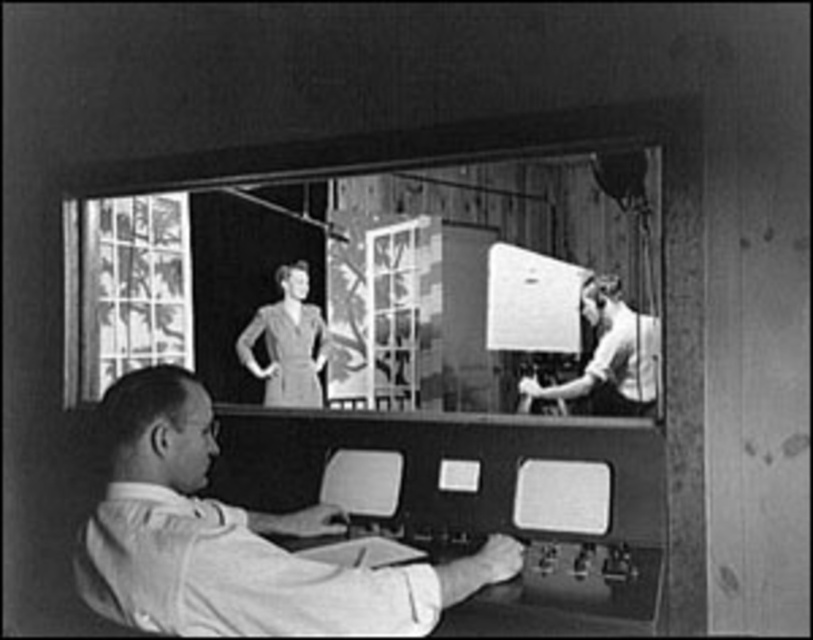
Based on the scene described, where is the smooth white shirt at center located in terms of coordinates?

The smooth white shirt at center is located at coordinates point [235,540].

You are a technician observing the live broadcast on the screen. You notice two points marked on the screen at coordinates point (644, 324) and point (270, 358). Which point is nearer to your viewpoint as you look at the screen?

Point (644, 324) is closer to the camera than point (270, 358), so the point nearer to your viewpoint as you look at the screen is point (644, 324).

You are a technician in the control room. You need to adjust the camera focus on the two points on the screen. Which point is closer to you, point (196, 381) or point (301, 332)?

Point (196, 381) is closer to the viewer than point (301, 332).